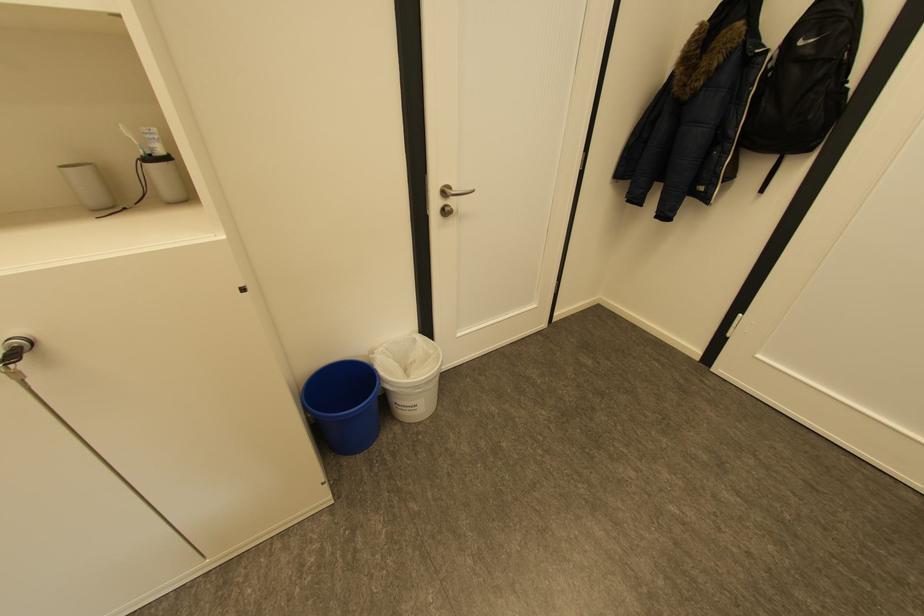
The height and width of the screenshot is (616, 924). Identify the location of cabinet key lock. (15, 355).